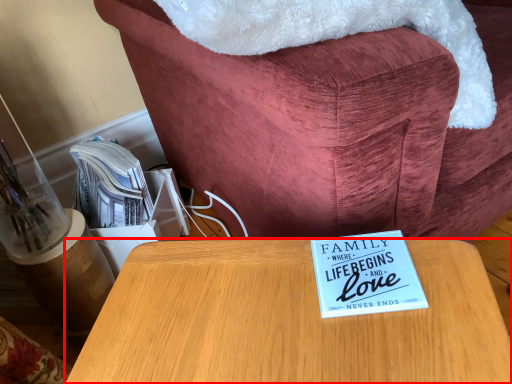
Question: From the image's perspective, where is table (annotated by the red box) located relative to furniture?

Choices:
 (A) below
 (B) above

Answer: (A)